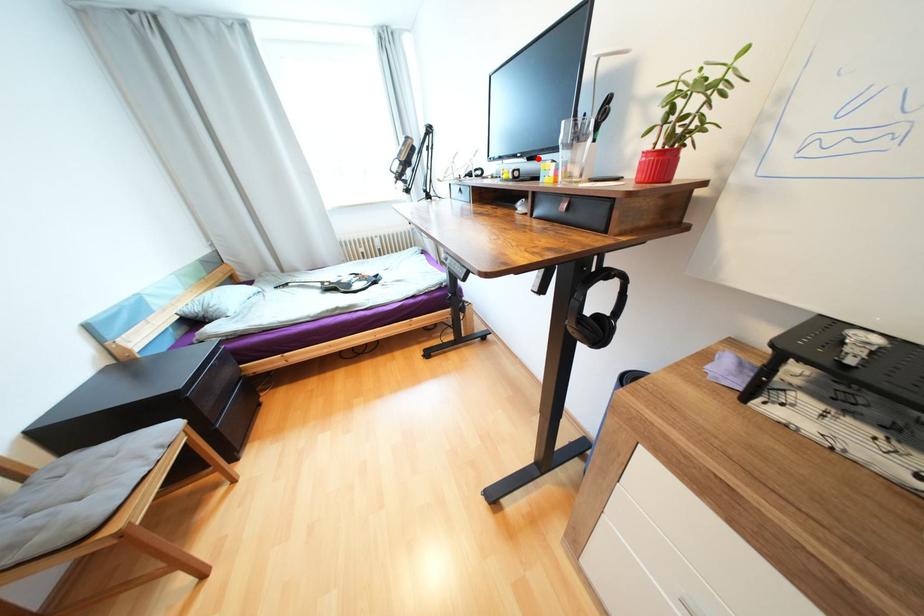
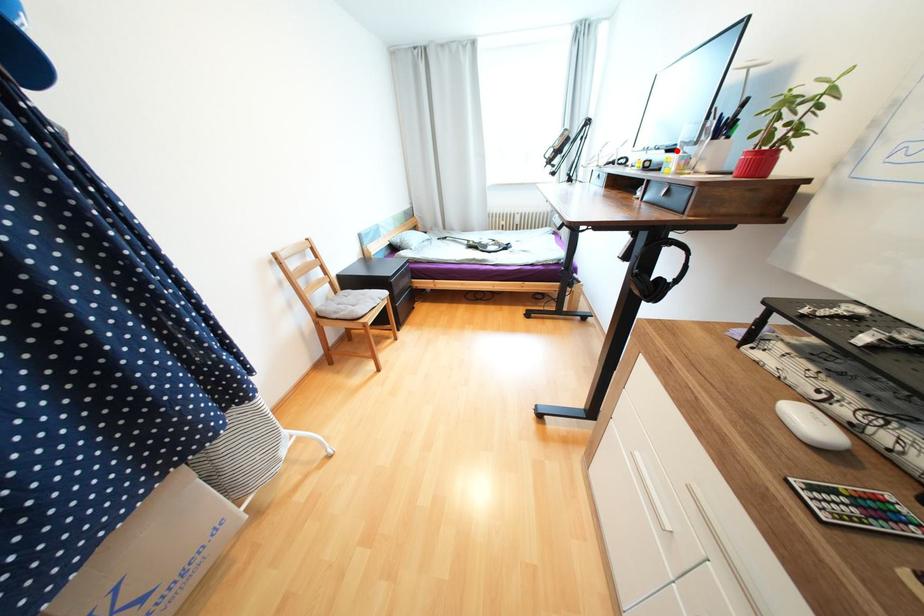
I am providing you with two images of the same scene from different viewpoints. A red point is marked on the first image and another point is marked on the second image. Is the marked point in image1 the same physical position as the marked point in image2?

Yes